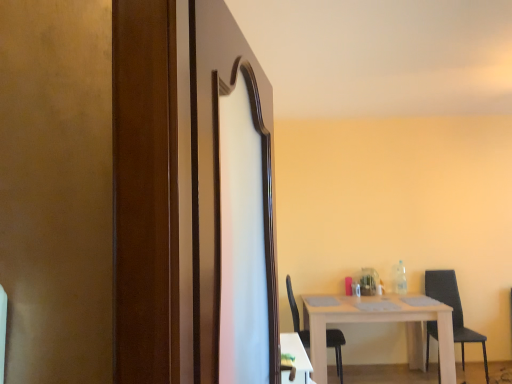
Question: Can you confirm if white wooden table at center, positioned as the 1th table in back-to-front order, is bigger than black matte chair at lower right, the 1th chair when ordered from left to right?

Choices:
 (A) no
 (B) yes

Answer: (B)

Question: Is white wooden table at center, positioned as the 1th table in right-to-left order, thinner than black matte chair at lower right, the 1th chair when ordered from left to right?

Choices:
 (A) no
 (B) yes

Answer: (A)

Question: Is the position of white wooden table at center, positioned as the 1th table in right-to-left order, more distant than that of black matte chair at lower right, the 1th chair when ordered from left to right?

Choices:
 (A) no
 (B) yes

Answer: (A)

Question: Is white wooden table at center, positioned as the 1th table in back-to-front order, completely or partially outside of black matte chair at lower right, the 1th chair when ordered from left to right?

Choices:
 (A) no
 (B) yes

Answer: (B)

Question: From the image's perspective, is white wooden table at center, positioned as the 1th table in back-to-front order, beneath black matte chair at lower right, positioned as the second chair in right-to-left order?

Choices:
 (A) yes
 (B) no

Answer: (A)

Question: Is wooden screen door at center inside the boundaries of white wooden table at center, which is counted as the 2th table, starting from the left, or outside?

Choices:
 (A) outside
 (B) inside

Answer: (A)

Question: Based on their sizes in the image, would you say wooden screen door at center is bigger or smaller than white wooden table at center, positioned as the 2th table in front-to-back order?

Choices:
 (A) small
 (B) big

Answer: (A)

Question: Is point (266, 296) closer or farther from the camera than point (446, 360)?

Choices:
 (A) farther
 (B) closer

Answer: (B)

Question: Visually, is wooden screen door at center positioned to the left or to the right of white wooden table at center, positioned as the 1th table in back-to-front order?

Choices:
 (A) left
 (B) right

Answer: (A)

Question: Considering the positions of point (484, 372) and point (300, 372), is point (484, 372) closer or farther from the camera than point (300, 372)?

Choices:
 (A) closer
 (B) farther

Answer: (B)

Question: Considering the positions of black fabric chair at right, which is the 1th chair in right-to-left order, and white glossy table at lower right, the 1th table when ordered from front to back, in the image, is black fabric chair at right, which is the 1th chair in right-to-left order, taller or shorter than white glossy table at lower right, the 1th table when ordered from front to back,?

Choices:
 (A) short
 (B) tall

Answer: (B)

Question: In terms of size, does black fabric chair at right, positioned as the second chair in left-to-right order, appear bigger or smaller than white glossy table at lower right, which is the 2th table in right-to-left order?

Choices:
 (A) small
 (B) big

Answer: (B)

Question: From the image's perspective, is black fabric chair at right, positioned as the second chair in left-to-right order, located above or below white glossy table at lower right, which is the 2th table in right-to-left order?

Choices:
 (A) above
 (B) below

Answer: (B)

Question: In the image, is wooden screen door at center positioned in front of or behind black matte chair at lower right, positioned as the second chair in right-to-left order?

Choices:
 (A) front
 (B) behind

Answer: (A)

Question: From a real-world perspective, relative to black matte chair at lower right, the 1th chair when ordered from left to right, is wooden screen door at center vertically above or below?

Choices:
 (A) above
 (B) below

Answer: (A)